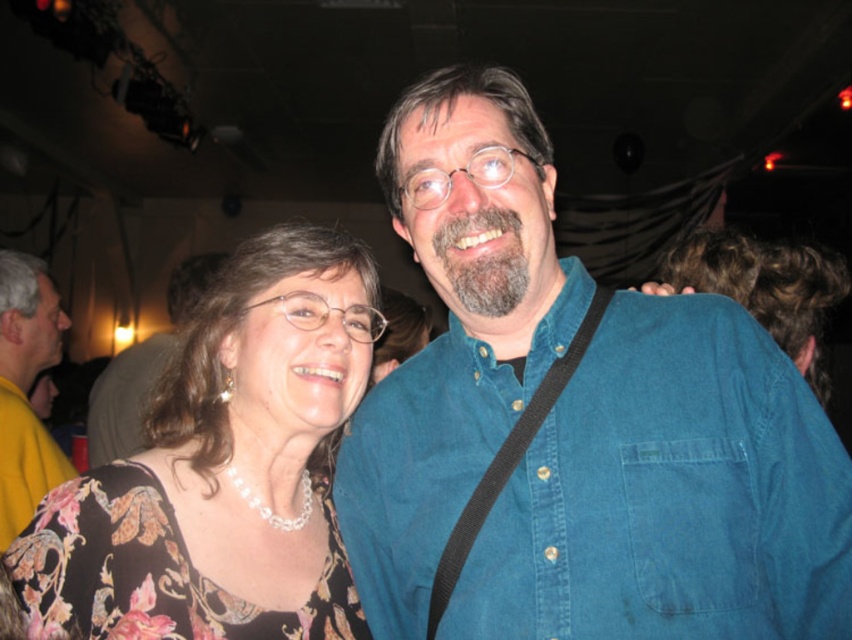
Based on the coordinates provided, which item in the scene is located at point (223,467)?

The point (223,467) corresponds to the floral patterned blouse at left.

You are trying to decide which shirt to wear for a casual outing. You see the blue denim shirt at center and the matte black shirt at center in the image. Which one appears taller?

The blue denim shirt at center is much taller than the matte black shirt at center, so the blue denim shirt at center appears taller.